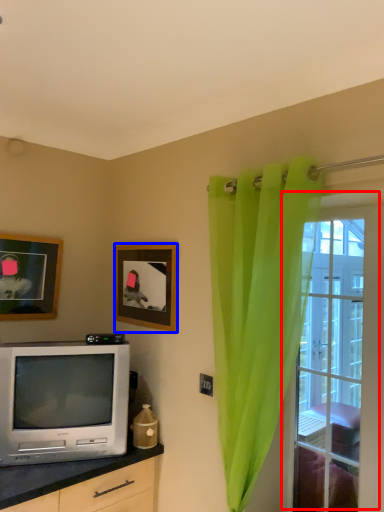
Question: Which of the following is the closest to the observer, window (highlighted by a red box) or picture frame (highlighted by a blue box)?

Choices:
 (A) window
 (B) picture frame

Answer: (A)